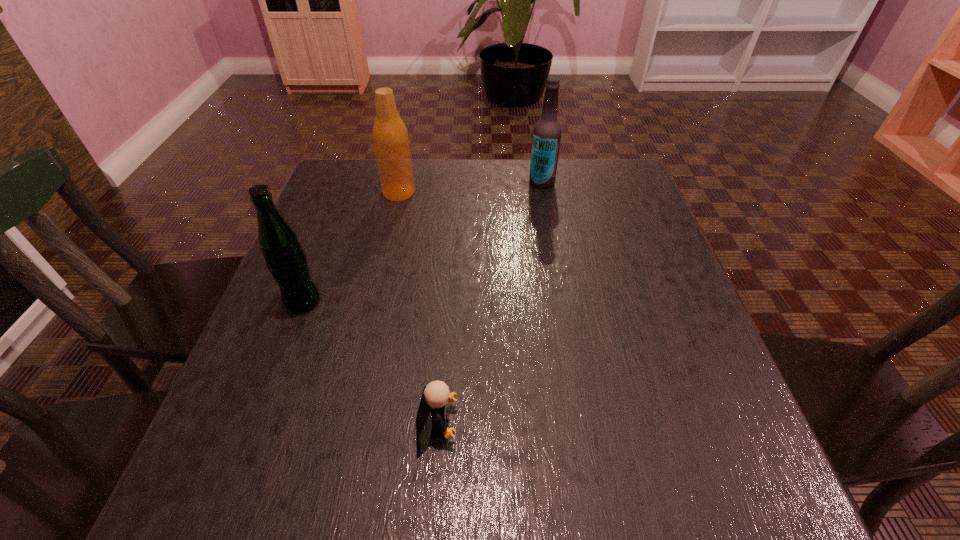
At what (x,y) coordinates should I click in order to perform the action: click on the rightmost object. Please return your answer as a coordinate pair (x, y). This screenshot has height=540, width=960. Looking at the image, I should click on (547, 131).

Find the location of a particular element. Image resolution: width=960 pixels, height=540 pixels. the second object from left to right is located at coordinates (390, 136).

Where is `the nearest beer bottle`? The width and height of the screenshot is (960, 540). the nearest beer bottle is located at coordinates (285, 258).

In order to click on the leftmost beer bottle in this screenshot , I will do `click(285, 258)`.

You are a GUI agent. You are given a task and a screenshot of the screen. Output one action in this format:
    pyautogui.click(x=<x>, y=<y>)
    Task: Click on the second object from right to left
    The width and height of the screenshot is (960, 540).
    Given the screenshot: What is the action you would take?
    pyautogui.click(x=435, y=395)

Find the location of a particular element. This screenshot has width=960, height=540. Lego is located at coordinates (435, 395).

The height and width of the screenshot is (540, 960). In order to click on blank space located 0.290m on the side of the rightmost object with the label in this screenshot , I will do tap(421, 183).

The image size is (960, 540). Find the location of `free location located 0.220m on the side of the rightmost object with the label`. free location located 0.220m on the side of the rightmost object with the label is located at coordinates (447, 183).

Find the location of a particular element. This screenshot has width=960, height=540. free space located on the side of the rightmost object with the label is located at coordinates (384, 183).

Where is `vacant region located 0.320m on the front of the third object from right to left`? vacant region located 0.320m on the front of the third object from right to left is located at coordinates (376, 294).